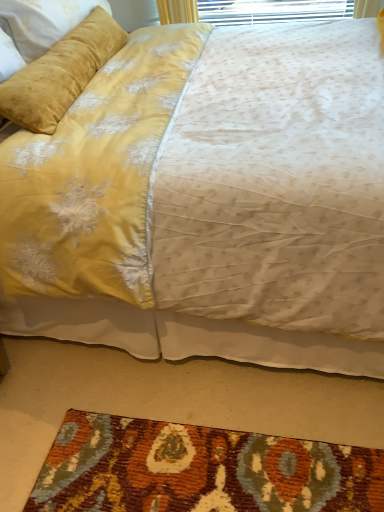
Question: Is velvet yellow bed at upper center bigger or smaller than velvet yellow pillow at upper left?

Choices:
 (A) small
 (B) big

Answer: (B)

Question: Considering the positions of velvet yellow bed at upper center and velvet yellow pillow at upper left in the image, is velvet yellow bed at upper center taller or shorter than velvet yellow pillow at upper left?

Choices:
 (A) short
 (B) tall

Answer: (B)

Question: Estimate the real-world distances between objects in this image. Which object is closer to the velvet yellow bed at upper center?

Choices:
 (A) textured wool mat at lower center
 (B) velvet yellow pillow at upper left

Answer: (B)

Question: Which of these objects is positioned farthest from the velvet yellow bed at upper center?

Choices:
 (A) velvet yellow pillow at upper left
 (B) textured wool mat at lower center

Answer: (B)